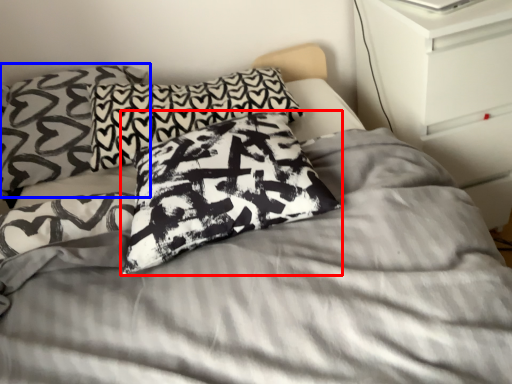
Question: Among these objects, which one is nearest to the camera, pillow (highlighted by a red box) or pillow (highlighted by a blue box)?

Choices:
 (A) pillow
 (B) pillow

Answer: (A)